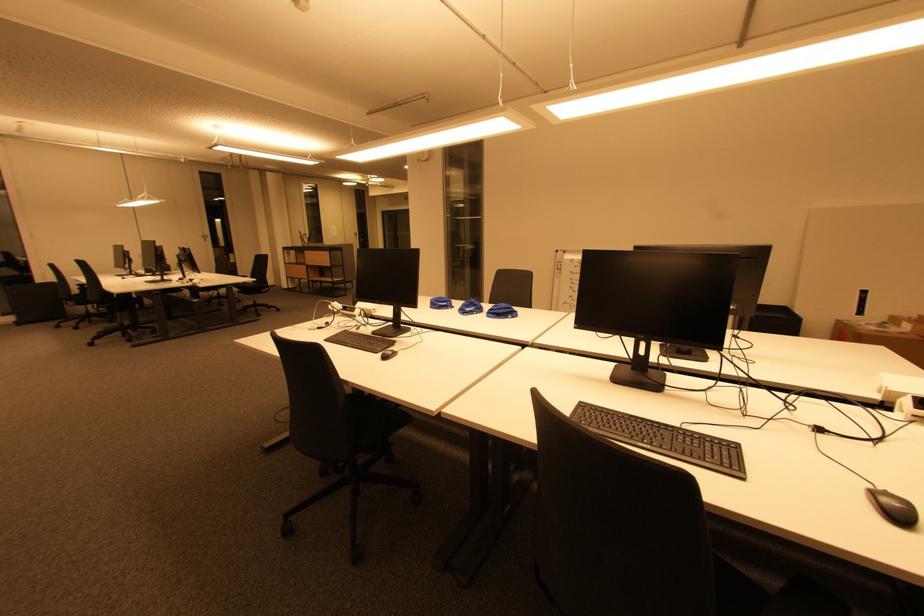
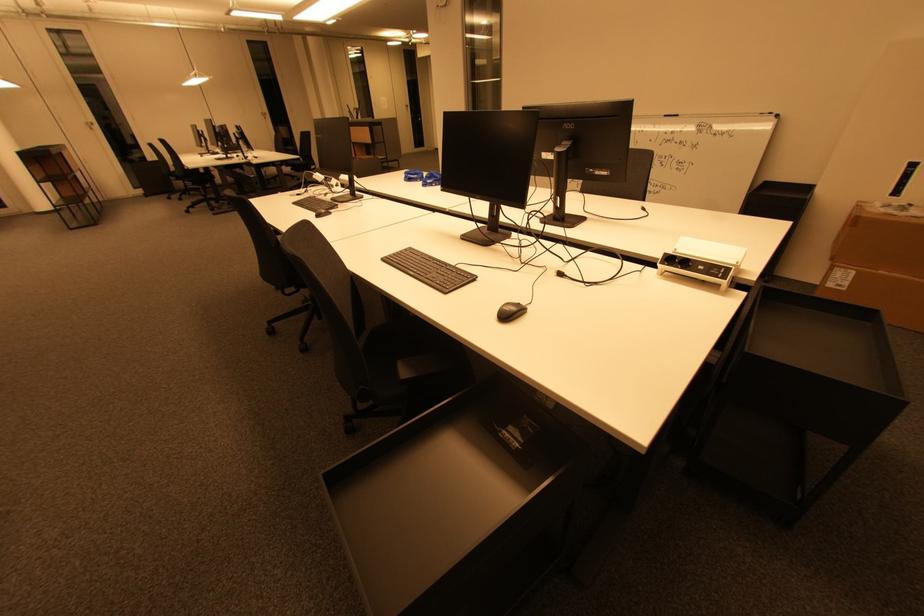
Question: Which direction would the cameraman need to move to produce the second image? Reply with the corresponding letter.

Choices:
 (A) Left
 (B) Right
 (C) Forward
 (D) Backward

Answer: (B)